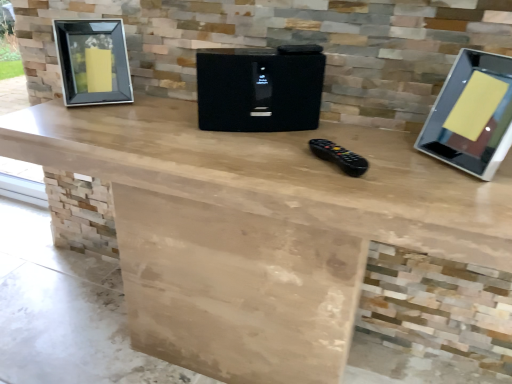
What is the approximate height of black glass picture frame at left?

22.55 centimeters.

I want to click on silver glossy monitor at right, so click(x=472, y=115).

Considering the sizes of black glass picture frame at left and black textured speaker at center in the image, is black glass picture frame at left taller or shorter than black textured speaker at center?

In the image, black glass picture frame at left appears to be taller than black textured speaker at center.

From the image's perspective, relative to black textured speaker at center, is black glass picture frame at left above or below?

black glass picture frame at left is situated higher than black textured speaker at center in the image.

From a real-world perspective, which object rests below the other?

In real-world perspective, black textured speaker at center is lower.

From the image's perspective, relative to black textured speaker at center, is black plastic remote control at center above or below?

Clearly, from the image's perspective, black plastic remote control at center is below black textured speaker at center.

Which object is positioned more to the right, black plastic remote control at center or black textured speaker at center?

black plastic remote control at center.

Does black plastic remote control at center turn towards black textured speaker at center?

No.

Are black plastic remote control at center and black textured speaker at center located far from each other?

black plastic remote control at center is actually quite close to black textured speaker at center.

In the scene shown: Is black plastic remote control at center far away from black glass picture frame at left?

No.

From a real-world perspective, is black plastic remote control at center above or below black glass picture frame at left?

In terms of real-world spatial position, black plastic remote control at center is below black glass picture frame at left.

Considering the relative sizes of black plastic remote control at center and black glass picture frame at left in the image provided, is black plastic remote control at center shorter than black glass picture frame at left?

Correct, black plastic remote control at center is not as tall as black glass picture frame at left.

Consider the image. Is black glass picture frame at left far from silver glossy monitor at right?

No, black glass picture frame at left is not far from silver glossy monitor at right.

Is black glass picture frame at left facing away from silver glossy monitor at right?

That's not correct — black glass picture frame at left is not looking away from silver glossy monitor at right.

Can you tell me how much black glass picture frame at left and silver glossy monitor at right differ in facing direction?

46.3 degrees separate the facing orientations of black glass picture frame at left and silver glossy monitor at right.

Where is `computer monitor above the black glass picture frame at left (from a real-world perspective)`? computer monitor above the black glass picture frame at left (from a real-world perspective) is located at coordinates (472, 115).

Is black plastic remote control at center surrounded by silver glossy monitor at right?

No, black plastic remote control at center is not a part of silver glossy monitor at right.

In the image, is silver glossy monitor at right positioned in front of or behind black plastic remote control at center?

In the image, silver glossy monitor at right appears in front of black plastic remote control at center.

Is silver glossy monitor at right looking in the opposite direction of black plastic remote control at center?

That's not correct — silver glossy monitor at right is not looking away from black plastic remote control at center.

From a real-world perspective, is silver glossy monitor at right below black plastic remote control at center?

No.

Which object is positioned more to the left, black glass picture frame at left or black plastic remote control at center?

black glass picture frame at left.

From the image's perspective, between black glass picture frame at left and black plastic remote control at center, who is located below?

black plastic remote control at center appears lower in the image.

From the picture: Is black glass picture frame at left taller than black plastic remote control at center?

Yes.

Locate an element on the screen. picture frame located on the left of black plastic remote control at center is located at coordinates (93, 62).

Considering the points (422, 136) and (287, 63), which point is in front, point (422, 136) or point (287, 63)?

The point (287, 63) is more forward.

Is the surface of silver glossy monitor at right in direct contact with black textured speaker at center?

No, silver glossy monitor at right is not making contact with black textured speaker at center.

Is silver glossy monitor at right bigger or smaller than black textured speaker at center?

Clearly, silver glossy monitor at right is smaller in size than black textured speaker at center.

From a real-world perspective, is silver glossy monitor at right physically above black textured speaker at center?

Indeed, from a real-world perspective, silver glossy monitor at right stands above black textured speaker at center.

At what (x,y) coordinates should I click in order to perform the action: click on appliance that is in front of the black glass picture frame at left. Please return your answer as a coordinate pair (x, y). Looking at the image, I should click on (260, 88).

You are a GUI agent. You are given a task and a screenshot of the screen. Output one action in this format:
    pyautogui.click(x=<x>, y=<y>)
    Task: Click on the appliance behind the black plastic remote control at center
    Image resolution: width=512 pixels, height=384 pixels.
    Given the screenshot: What is the action you would take?
    pyautogui.click(x=260, y=88)

Based on their spatial positions, is black textured speaker at center or silver glossy monitor at right closer to black plastic remote control at center?

black textured speaker at center is positioned closer to the anchor black plastic remote control at center.

Looking at the image, which one is located closer to black textured speaker at center, black glass picture frame at left or silver glossy monitor at right?

The object closer to black textured speaker at center is silver glossy monitor at right.

From the image, which object appears to be farther from black textured speaker at center, black glass picture frame at left or black plastic remote control at center?

black glass picture frame at left lies further to black textured speaker at center than the other object.

Based on their spatial positions, is black glass picture frame at left or black textured speaker at center further from black plastic remote control at center?

black glass picture frame at left is further to black plastic remote control at center.

Estimate the real-world distances between objects in this image. Which object is closer to silver glossy monitor at right, black glass picture frame at left or black plastic remote control at center?

black plastic remote control at center is closer to silver glossy monitor at right.

When comparing their distances from black plastic remote control at center, does silver glossy monitor at right or black textured speaker at center seem closer?

Among the two, black textured speaker at center is located nearer to black plastic remote control at center.

When comparing their distances from black textured speaker at center, does silver glossy monitor at right or black plastic remote control at center seem further?

silver glossy monitor at right is further to black textured speaker at center.

From the image, which object appears to be nearer to black glass picture frame at left, black plastic remote control at center or silver glossy monitor at right?

black plastic remote control at center is positioned closer to the anchor black glass picture frame at left.

At what (x,y) coordinates should I click in order to perform the action: click on appliance situated between black glass picture frame at left and silver glossy monitor at right from left to right. Please return your answer as a coordinate pair (x, y). Looking at the image, I should click on (260, 88).

Locate an element on the screen. The height and width of the screenshot is (384, 512). game controller between black glass picture frame at left and silver glossy monitor at right in the horizontal direction is located at coordinates (339, 157).

I want to click on appliance between black glass picture frame at left and black plastic remote control at center, so coord(260,88).

Image resolution: width=512 pixels, height=384 pixels. I want to click on game controller located between black textured speaker at center and silver glossy monitor at right in the left-right direction, so click(x=339, y=157).